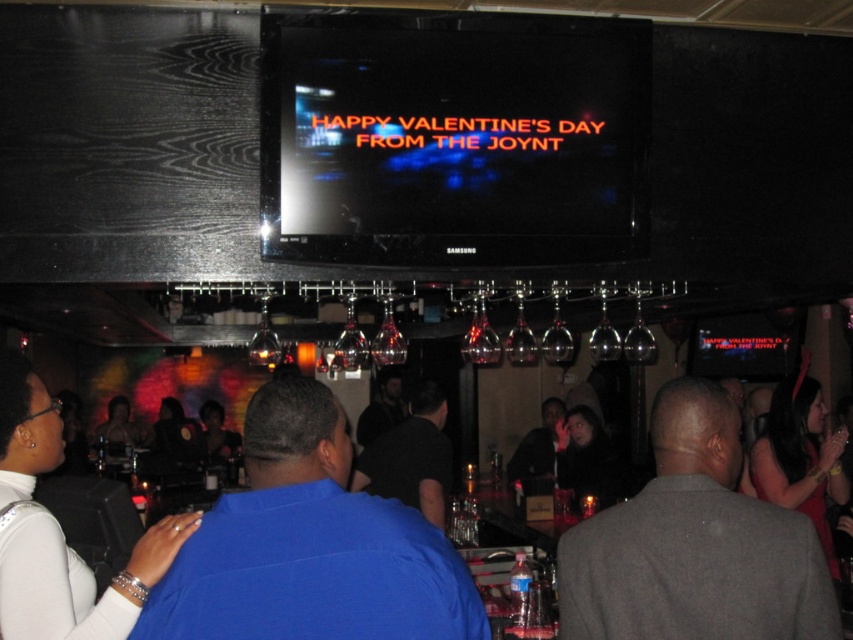
Question: Can you confirm if blue matte shirt at center is positioned to the left of black matte shirt at center?

Choices:
 (A) yes
 (B) no

Answer: (A)

Question: Can you confirm if blue matte shirt at center is bigger than gray fabric suit at center?

Choices:
 (A) no
 (B) yes

Answer: (A)

Question: Which point is closer to the camera?

Choices:
 (A) coord(688,417)
 (B) coord(413,589)
 (C) coord(384,394)

Answer: (B)

Question: Which object appears closest to the camera in this image?

Choices:
 (A) blue matte shirt at center
 (B) gray fabric suit at center

Answer: (A)

Question: Among these points, which one is farthest from the camera?

Choices:
 (A) tap(378, 404)
 (B) tap(380, 504)
 (C) tap(613, 602)

Answer: (A)

Question: Does gray fabric suit at center have a greater width compared to dark gray shirt at center?

Choices:
 (A) no
 (B) yes

Answer: (B)